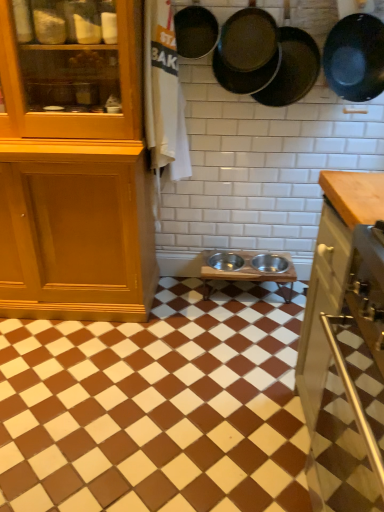
The width and height of the screenshot is (384, 512). What do you see at coordinates (247, 52) in the screenshot?
I see `dark brown matte frying pan at upper right, placed as the 2th frying pan when sorted from left to right` at bounding box center [247, 52].

How much space does matte black frying pan at upper right, which is counted as the 3th frying pan, starting from the left, occupy horizontally?

matte black frying pan at upper right, which is counted as the 3th frying pan, starting from the left, is 7.68 inches wide.

What do you see at coordinates (355, 57) in the screenshot?
I see `black matte frying pan at upper right, which is the 1th frying pan from right to left` at bounding box center [355, 57].

Identify the location of metallic silver bowls at center. (157, 407).

This screenshot has height=512, width=384. Describe the element at coordinates (157, 407) in the screenshot. I see `metallic silver bowls at center` at that location.

In order to click on dark brown matte frying pan at upper right, placed as the 2th frying pan when sorted from left to right in this screenshot , I will do `click(247, 52)`.

Do you think black matte frying pan at upper right, which is the 1th frying pan from right to left, is within dark brown matte frying pan at upper right, placed as the 2th frying pan when sorted from left to right, or outside of it?

The correct answer is: outside.

Is black matte frying pan at upper right, which is the 1th frying pan from right to left, thinner than dark brown matte frying pan at upper right, which is the third frying pan in right-to-left order?

No.

Is black matte frying pan at upper right, the 4th frying pan viewed from the left, with dark brown matte frying pan at upper right, placed as the 2th frying pan when sorted from left to right?

No, black matte frying pan at upper right, the 4th frying pan viewed from the left, is not with dark brown matte frying pan at upper right, placed as the 2th frying pan when sorted from left to right.

Is black matte frying pan at upper right, the 4th frying pan viewed from the left, turned away from matte black frying pan at upper center, which appears as the fourth frying pan when viewed from the right?

No.

Which of these two, black matte frying pan at upper right, which is the 1th frying pan from right to left, or matte black frying pan at upper center, which appears as the fourth frying pan when viewed from the right, is wider?

black matte frying pan at upper right, which is the 1th frying pan from right to left.

Which is more to the right, black matte frying pan at upper right, the 4th frying pan viewed from the left, or matte black frying pan at upper center, the first frying pan viewed from the left?

black matte frying pan at upper right, the 4th frying pan viewed from the left, is more to the right.

How many degrees apart are the facing directions of matte black frying pan at upper center, the first frying pan viewed from the left, and matte black frying pan at upper right, the second frying pan in the right-to-left sequence?

The facing directions of matte black frying pan at upper center, the first frying pan viewed from the left, and matte black frying pan at upper right, the second frying pan in the right-to-left sequence, are 0.373 degrees apart.

From a real-world perspective, which object rests below the other?

matte black frying pan at upper right, which is counted as the 3th frying pan, starting from the left, is physically lower.

From the image's perspective, which is above, matte black frying pan at upper center, which appears as the fourth frying pan when viewed from the right, or matte black frying pan at upper right, which is counted as the 3th frying pan, starting from the left?

matte black frying pan at upper center, which appears as the fourth frying pan when viewed from the right, appears higher in the image.

Is matte black frying pan at upper center, which appears as the fourth frying pan when viewed from the right, placed right next to matte black frying pan at upper right, the second frying pan in the right-to-left sequence?

matte black frying pan at upper center, which appears as the fourth frying pan when viewed from the right, is not next to matte black frying pan at upper right, the second frying pan in the right-to-left sequence, and they're not touching.

Is dark brown matte frying pan at upper right, placed as the 2th frying pan when sorted from left to right, next to black matte frying pan at upper right, which is the 1th frying pan from right to left?

No, dark brown matte frying pan at upper right, placed as the 2th frying pan when sorted from left to right, is not beside black matte frying pan at upper right, which is the 1th frying pan from right to left.

Considering the sizes of objects dark brown matte frying pan at upper right, which is the third frying pan in right-to-left order, and black matte frying pan at upper right, which is the 1th frying pan from right to left, in the image provided, who is taller, dark brown matte frying pan at upper right, which is the third frying pan in right-to-left order, or black matte frying pan at upper right, which is the 1th frying pan from right to left,?

black matte frying pan at upper right, which is the 1th frying pan from right to left.

Based on their positions, is dark brown matte frying pan at upper right, placed as the 2th frying pan when sorted from left to right, located to the left or right of black matte frying pan at upper right, the 4th frying pan viewed from the left?

Clearly, dark brown matte frying pan at upper right, placed as the 2th frying pan when sorted from left to right, is on the left of black matte frying pan at upper right, the 4th frying pan viewed from the left, in the image.

Between point (238, 53) and point (379, 38), which one is positioned behind?

Positioned behind is point (379, 38).

Can black matte frying pan at upper right, which is the 1th frying pan from right to left, be found inside metallic silver bowls at center?

That's incorrect, black matte frying pan at upper right, which is the 1th frying pan from right to left, is not inside metallic silver bowls at center.

Considering the sizes of objects metallic silver bowls at center and black matte frying pan at upper right, the 4th frying pan viewed from the left, in the image provided, who is thinner, metallic silver bowls at center or black matte frying pan at upper right, the 4th frying pan viewed from the left,?

Thinner between the two is black matte frying pan at upper right, the 4th frying pan viewed from the left.

Measure the distance from metallic silver bowls at center to black matte frying pan at upper right, which is the 1th frying pan from right to left.

The distance of metallic silver bowls at center from black matte frying pan at upper right, which is the 1th frying pan from right to left, is 4.74 feet.

From the image's perspective, is matte black frying pan at upper center, which appears as the fourth frying pan when viewed from the right, located beneath black matte frying pan at upper right, which is the 1th frying pan from right to left?

Incorrect, from the image's perspective, matte black frying pan at upper center, which appears as the fourth frying pan when viewed from the right, is higher than black matte frying pan at upper right, which is the 1th frying pan from right to left.

Considering the relative sizes of matte black frying pan at upper center, which appears as the fourth frying pan when viewed from the right, and black matte frying pan at upper right, the 4th frying pan viewed from the left, in the image provided, is matte black frying pan at upper center, which appears as the fourth frying pan when viewed from the right, thinner than black matte frying pan at upper right, the 4th frying pan viewed from the left,?

Indeed, matte black frying pan at upper center, which appears as the fourth frying pan when viewed from the right, has a lesser width compared to black matte frying pan at upper right, the 4th frying pan viewed from the left.

Is the surface of matte black frying pan at upper center, the first frying pan viewed from the left, in direct contact with black matte frying pan at upper right, the 4th frying pan viewed from the left?

matte black frying pan at upper center, the first frying pan viewed from the left, and black matte frying pan at upper right, the 4th frying pan viewed from the left, are clearly separated.

Is point (213, 42) farther from camera compared to point (373, 66)?

Yes, it is.

Could you tell me if matte black frying pan at upper right, which is counted as the 3th frying pan, starting from the left, is turned towards dark brown matte frying pan at upper right, which is the third frying pan in right-to-left order?

No, matte black frying pan at upper right, which is counted as the 3th frying pan, starting from the left, is not turned towards dark brown matte frying pan at upper right, which is the third frying pan in right-to-left order.

What's the angular difference between matte black frying pan at upper right, the second frying pan in the right-to-left sequence, and dark brown matte frying pan at upper right, placed as the 2th frying pan when sorted from left to right,'s facing directions?

The angle between the facing direction of matte black frying pan at upper right, the second frying pan in the right-to-left sequence, and the facing direction of dark brown matte frying pan at upper right, placed as the 2th frying pan when sorted from left to right, is 0.168 degrees.

Who is bigger, matte black frying pan at upper right, the second frying pan in the right-to-left sequence, or dark brown matte frying pan at upper right, placed as the 2th frying pan when sorted from left to right?

matte black frying pan at upper right, the second frying pan in the right-to-left sequence.

Can we say matte black frying pan at upper right, which is counted as the 3th frying pan, starting from the left, lies outside dark brown matte frying pan at upper right, which is the third frying pan in right-to-left order?

No, matte black frying pan at upper right, which is counted as the 3th frying pan, starting from the left, is inside dark brown matte frying pan at upper right, which is the third frying pan in right-to-left order,'s boundary.

Find the location of a particular element. Image resolution: width=384 pixels, height=512 pixels. the 2nd frying pan behind when counting from the black matte frying pan at upper right, which is the 1th frying pan from right to left is located at coordinates (247, 52).

There is a black matte frying pan at upper right, the 4th frying pan viewed from the left. Where is `the 3rd frying pan above it (from the image's perspective)`? This screenshot has height=512, width=384. the 3rd frying pan above it (from the image's perspective) is located at coordinates (195, 31).

From the image, which object appears to be farther from matte black frying pan at upper right, which is counted as the 3th frying pan, starting from the left, dark brown matte frying pan at upper right, placed as the 2th frying pan when sorted from left to right, or black matte frying pan at upper right, which is the 1th frying pan from right to left?

Based on the image, black matte frying pan at upper right, which is the 1th frying pan from right to left, appears to be further to matte black frying pan at upper right, which is counted as the 3th frying pan, starting from the left.

When comparing their distances from metallic silver bowls at center, does dark brown matte frying pan at upper right, placed as the 2th frying pan when sorted from left to right, or black matte frying pan at upper right, which is the 1th frying pan from right to left, seem further?

black matte frying pan at upper right, which is the 1th frying pan from right to left.

Looking at the image, which one is located further to metallic silver bowls at center, dark brown matte frying pan at upper right, which is the third frying pan in right-to-left order, or matte black frying pan at upper center, the first frying pan viewed from the left?

Among the two, matte black frying pan at upper center, the first frying pan viewed from the left, is located further to metallic silver bowls at center.

From the image, which object appears to be nearer to matte black frying pan at upper center, which appears as the fourth frying pan when viewed from the right, metallic silver bowls at center or dark brown matte frying pan at upper right, placed as the 2th frying pan when sorted from left to right?

Among the two, dark brown matte frying pan at upper right, placed as the 2th frying pan when sorted from left to right, is located nearer to matte black frying pan at upper center, which appears as the fourth frying pan when viewed from the right.

Estimate the real-world distances between objects in this image. Which object is further from black matte frying pan at upper right, which is the 1th frying pan from right to left, metallic silver bowls at center or dark brown matte frying pan at upper right, which is the third frying pan in right-to-left order?

metallic silver bowls at center lies further to black matte frying pan at upper right, which is the 1th frying pan from right to left, than the other object.

From the picture: Looking at the image, which one is located closer to matte black frying pan at upper center, the first frying pan viewed from the left, black matte frying pan at upper right, the 4th frying pan viewed from the left, or matte black frying pan at upper right, which is counted as the 3th frying pan, starting from the left?

matte black frying pan at upper right, which is counted as the 3th frying pan, starting from the left, is positioned closer to the anchor matte black frying pan at upper center, the first frying pan viewed from the left.

Which object lies nearer to the anchor point matte black frying pan at upper center, the first frying pan viewed from the left, matte black frying pan at upper right, which is counted as the 3th frying pan, starting from the left, or metallic silver bowls at center?

matte black frying pan at upper right, which is counted as the 3th frying pan, starting from the left, lies closer to matte black frying pan at upper center, the first frying pan viewed from the left, than the other object.

Looking at the image, which one is located further to matte black frying pan at upper right, the second frying pan in the right-to-left sequence, black matte frying pan at upper right, the 4th frying pan viewed from the left, or dark brown matte frying pan at upper right, placed as the 2th frying pan when sorted from left to right?

The object further to matte black frying pan at upper right, the second frying pan in the right-to-left sequence, is black matte frying pan at upper right, the 4th frying pan viewed from the left.

Locate an element on the screen. frying pan located between matte black frying pan at upper center, which appears as the fourth frying pan when viewed from the right, and matte black frying pan at upper right, which is counted as the 3th frying pan, starting from the left, in the left-right direction is located at coordinates (247, 52).

Identify the location of frying pan situated between dark brown matte frying pan at upper right, placed as the 2th frying pan when sorted from left to right, and black matte frying pan at upper right, which is the 1th frying pan from right to left, from left to right. (292, 69).

This screenshot has width=384, height=512. What are the coordinates of `frying pan between matte black frying pan at upper right, the second frying pan in the right-to-left sequence, and metallic silver bowls at center in the up-down direction` in the screenshot? It's located at (355, 57).